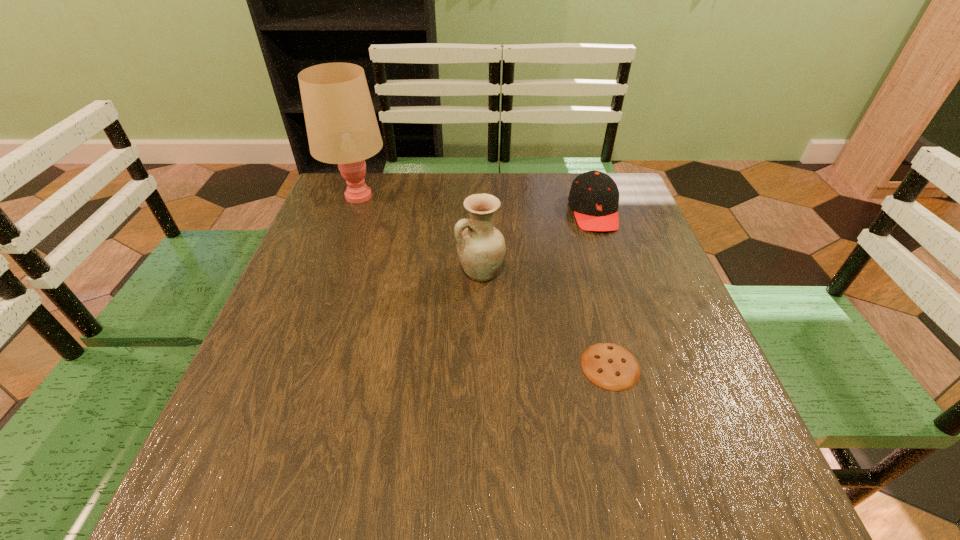
Identify the location of free space located 0.170m on the back of the cookie. (588, 283).

The height and width of the screenshot is (540, 960). What are the coordinates of `lampshade that is at the far edge` in the screenshot? It's located at (341, 124).

In order to click on cap that is at the far edge in this screenshot , I will do `click(594, 196)`.

Identify the location of object situated at the left edge. This screenshot has height=540, width=960. (341, 124).

The height and width of the screenshot is (540, 960). Find the location of `cap that is at the right edge`. cap that is at the right edge is located at coordinates (594, 196).

Identify the location of cookie located in the right edge section of the desktop. (610, 366).

At what (x,y) coordinates should I click in order to perform the action: click on object present at the far left corner. Please return your answer as a coordinate pair (x, y). Image resolution: width=960 pixels, height=540 pixels. Looking at the image, I should click on (341, 124).

I want to click on object positioned at the far right corner, so click(594, 196).

I want to click on vacant space at the far edge of the desktop, so click(490, 187).

In the image, there is a desktop. In order to click on free space at the left edge in this screenshot , I will do `click(336, 228)`.